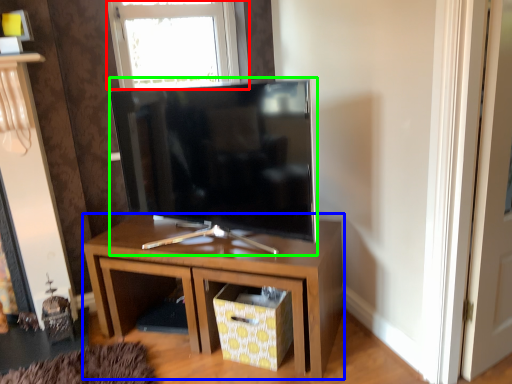
Question: Which object is the closest to the window (highlighted by a red box)? Choose among these: nightstand (highlighted by a blue box) or television (highlighted by a green box).

Choices:
 (A) nightstand
 (B) television

Answer: (B)